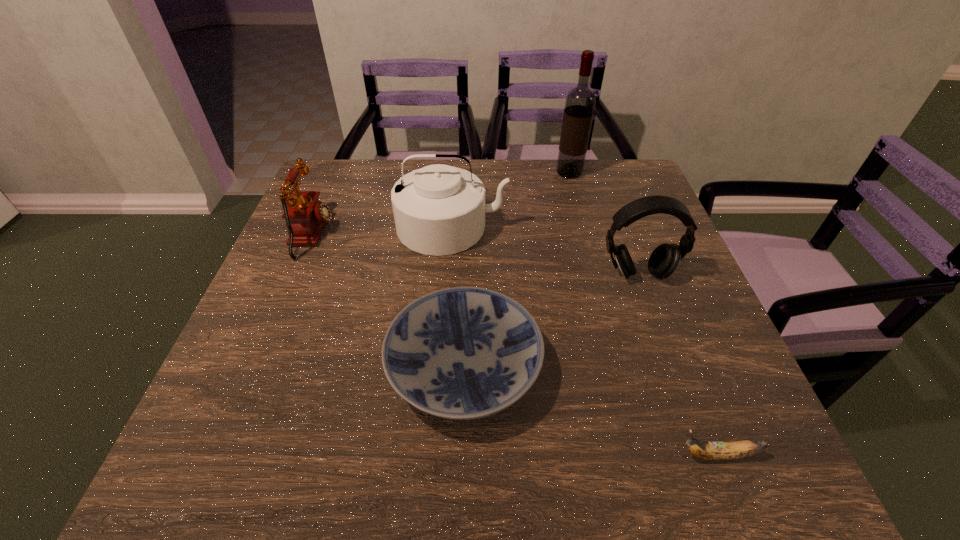
At what (x,y) coordinates should I click in order to perform the action: click on vacant space located 0.230m on the ear cups of the earphone. Please return your answer as a coordinate pair (x, y). Looking at the image, I should click on (674, 375).

Locate an element on the screen. This screenshot has height=540, width=960. free location located on the dial of the telephone is located at coordinates (376, 235).

This screenshot has width=960, height=540. I want to click on blank area located 0.260m on the left of the plate, so click(252, 367).

I want to click on vacant space located 0.260m at the stem of the nearest object, so click(518, 455).

I want to click on free space located 0.350m at the stem of the nearest object, so click(464, 455).

The width and height of the screenshot is (960, 540). What are the coordinates of `free space located 0.130m at the stem of the nearest object` in the screenshot? It's located at (597, 455).

Identify the location of wine bottle situated at the far edge. The height and width of the screenshot is (540, 960). (580, 101).

This screenshot has height=540, width=960. Find the location of `kettle present at the far edge`. kettle present at the far edge is located at coordinates (439, 210).

You are a GUI agent. You are given a task and a screenshot of the screen. Output one action in this format:
    pyautogui.click(x=<x>, y=<y>)
    Task: Click on the plate situated at the near edge
    The image size is (960, 540).
    Given the screenshot: What is the action you would take?
    pyautogui.click(x=463, y=353)

Locate an element on the screen. banana at the near edge is located at coordinates (738, 449).